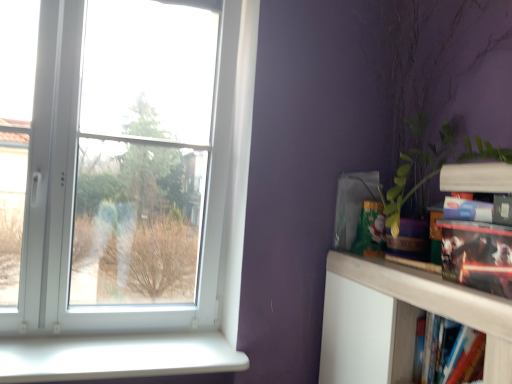
I want to click on white matte shelf at upper right, so click(426, 292).

Identify the location of white plastic window at upper left. The width and height of the screenshot is (512, 384). (71, 227).

What do you see at coordinates (451, 352) in the screenshot? I see `hardcover book at lower right, arranged as the first book when ordered from the bottom` at bounding box center [451, 352].

The image size is (512, 384). Find the location of `white matte shelf at upper right`. white matte shelf at upper right is located at coordinates (426, 292).

In the scene shown: Is white matte shelf at upper right closer to camera compared to hardcover book at lower right, arranged as the first book when ordered from the bottom?

Yes, white matte shelf at upper right is in front of hardcover book at lower right, arranged as the first book when ordered from the bottom.

Which of these two, white matte shelf at upper right or hardcover book at lower right, arranged as the first book when ordered from the bottom, is bigger?

white matte shelf at upper right is bigger.

Based on the photo, between white matte shelf at upper right and hardcover book at lower right, arranged as the first book when ordered from the bottom, which one appears on the right side from the viewer's perspective?

Positioned to the right is hardcover book at lower right, arranged as the first book when ordered from the bottom.

From a real-world perspective, which object rests below the other?

white matte shelf at upper right.

Can you tell me how much hardcover book at lower right, arranged as the first book when ordered from the bottom, and matt black book at right, positioned as the 1th book in top-to-bottom order, differ in facing direction?

The angle between the facing direction of hardcover book at lower right, arranged as the first book when ordered from the bottom, and the facing direction of matt black book at right, positioned as the 1th book in top-to-bottom order, is 1.79 degrees.

Which object is closer to the camera, hardcover book at lower right, arranged as the first book when ordered from the bottom, or matt black book at right, positioned as the 1th book in top-to-bottom order?

matt black book at right, positioned as the 1th book in top-to-bottom order, is more forward.

Is matt black book at right, the second book in the bottom-to-top sequence, at the back of hardcover book at lower right, the 2th book when ordered from top to bottom?

hardcover book at lower right, the 2th book when ordered from top to bottom, is not turned away from matt black book at right, the second book in the bottom-to-top sequence.

From the image's perspective, which one is positioned lower, hardcover book at lower right, arranged as the first book when ordered from the bottom, or matt black book at right, positioned as the 1th book in top-to-bottom order?

hardcover book at lower right, arranged as the first book when ordered from the bottom, appears lower in the image.

How far apart are matt black book at right, the second book in the bottom-to-top sequence, and white plastic window sill at lower left?

matt black book at right, the second book in the bottom-to-top sequence, is 3.71 feet away from white plastic window sill at lower left.

Are matt black book at right, the second book in the bottom-to-top sequence, and white plastic window sill at lower left far apart?

Indeed, matt black book at right, the second book in the bottom-to-top sequence, is not near white plastic window sill at lower left.

Does matt black book at right, the second book in the bottom-to-top sequence, have a greater height compared to white plastic window sill at lower left?

Yes.

From the image's perspective, is green leafy plant at right positioned above or below white matte shelf at upper right?

Clearly, from the image's perspective, green leafy plant at right is above white matte shelf at upper right.

From a real-world perspective, is green leafy plant at right positioned over white matte shelf at upper right based on gravity?

Correct, in the physical world, green leafy plant at right is higher than white matte shelf at upper right.

Who is taller, green leafy plant at right or white matte shelf at upper right?

Standing taller between the two is green leafy plant at right.

Is white plastic window at upper left looking in the opposite direction of white plastic window sill at lower left?

white plastic window at upper left is not turned away from white plastic window sill at lower left.

Considering the sizes of white plastic window at upper left and white plastic window sill at lower left in the image, is white plastic window at upper left wider or thinner than white plastic window sill at lower left?

In the image, white plastic window at upper left appears to be more narrow than white plastic window sill at lower left.

Considering the sizes of objects white plastic window at upper left and white plastic window sill at lower left in the image provided, who is taller, white plastic window at upper left or white plastic window sill at lower left?

white plastic window at upper left is taller.

The height and width of the screenshot is (384, 512). Identify the location of window that appears above the white plastic window sill at lower left (from a real-world perspective). (71, 227).

Could you tell me if white matte shelf at upper right is facing white plastic window sill at lower left?

Yes.

How many degrees apart are the facing directions of white matte shelf at upper right and white plastic window sill at lower left?

The angle between the facing direction of white matte shelf at upper right and the facing direction of white plastic window sill at lower left is 88.9 degrees.

From a real-world perspective, between white matte shelf at upper right and white plastic window sill at lower left, who is vertically higher?

From a 3D spatial view, white matte shelf at upper right is above.

Does white matte shelf at upper right have a larger size compared to white plastic window sill at lower left?

Yes, white matte shelf at upper right is bigger than white plastic window sill at lower left.

From a real-world perspective, is matt black book at right, the second book in the bottom-to-top sequence, physically above green leafy plant at right?

No.

Is matt black book at right, positioned as the 1th book in top-to-bottom order, positioned far away from green leafy plant at right?

Actually, matt black book at right, positioned as the 1th book in top-to-bottom order, and green leafy plant at right are a little close together.

From the picture: Is green leafy plant at right at the back of matt black book at right, the second book in the bottom-to-top sequence?

That's right, matt black book at right, the second book in the bottom-to-top sequence, is facing away from green leafy plant at right.

From the picture: Can you confirm if matt black book at right, positioned as the 1th book in top-to-bottom order, is thinner than green leafy plant at right?

Yes.

Starting from the white matte shelf at upper right, which book is the 1st one to the right? Please provide its 2D coordinates.

[(451, 352)]

Find the location of a particular element. The image size is (512, 384). book behind the matt black book at right, positioned as the 1th book in top-to-bottom order is located at coordinates pyautogui.click(x=451, y=352).

From the image, which object appears to be farther from white plastic window at upper left, white plastic window sill at lower left or matt black book at right, positioned as the 1th book in top-to-bottom order?

The object further to white plastic window at upper left is matt black book at right, positioned as the 1th book in top-to-bottom order.

Estimate the real-world distances between objects in this image. Which object is further from white plastic window at upper left, white matte shelf at upper right or matt black book at right, positioned as the 1th book in top-to-bottom order?

The object further to white plastic window at upper left is matt black book at right, positioned as the 1th book in top-to-bottom order.

Which object lies nearer to the anchor point green leafy plant at right, white plastic window sill at lower left or matt black book at right, the second book in the bottom-to-top sequence?

matt black book at right, the second book in the bottom-to-top sequence.

Based on their spatial positions, is white matte shelf at upper right or hardcover book at lower right, arranged as the first book when ordered from the bottom, closer to matt black book at right, positioned as the 1th book in top-to-bottom order?

Among the two, white matte shelf at upper right is located nearer to matt black book at right, positioned as the 1th book in top-to-bottom order.

Based on their spatial positions, is white matte shelf at upper right or white plastic window at upper left further from matt black book at right, the second book in the bottom-to-top sequence?

The object further to matt black book at right, the second book in the bottom-to-top sequence, is white plastic window at upper left.

When comparing their distances from white matte shelf at upper right, does hardcover book at lower right, the 2th book when ordered from top to bottom, or matt black book at right, the second book in the bottom-to-top sequence, seem closer?

hardcover book at lower right, the 2th book when ordered from top to bottom, is positioned closer to the anchor white matte shelf at upper right.

When comparing their distances from white plastic window at upper left, does green leafy plant at right or white plastic window sill at lower left seem further?

green leafy plant at right is positioned further to the anchor white plastic window at upper left.

From the image, which object appears to be nearer to white plastic window sill at lower left, hardcover book at lower right, the 2th book when ordered from top to bottom, or matt black book at right, positioned as the 1th book in top-to-bottom order?

Among the two, hardcover book at lower right, the 2th book when ordered from top to bottom, is located nearer to white plastic window sill at lower left.

I want to click on window sill between white plastic window at upper left and hardcover book at lower right, arranged as the first book when ordered from the bottom, from left to right, so click(116, 357).

The width and height of the screenshot is (512, 384). In order to click on plant between white plastic window sill at lower left and matt black book at right, the second book in the bottom-to-top sequence, from left to right in this screenshot , I will do 433,76.

Find the location of `book between white plastic window at upper left and green leafy plant at right`. book between white plastic window at upper left and green leafy plant at right is located at coordinates 451,352.

Where is `book between white plastic window at upper left and matt black book at right, the second book in the bottom-to-top sequence`? This screenshot has width=512, height=384. book between white plastic window at upper left and matt black book at right, the second book in the bottom-to-top sequence is located at coordinates (451, 352).